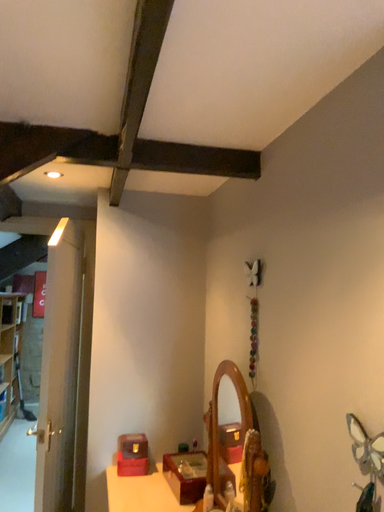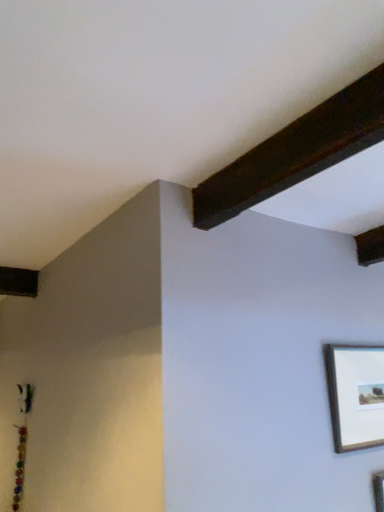
Question: How did the camera likely rotate when shooting the video?

Choices:
 (A) rotated left
 (B) rotated right

Answer: (B)